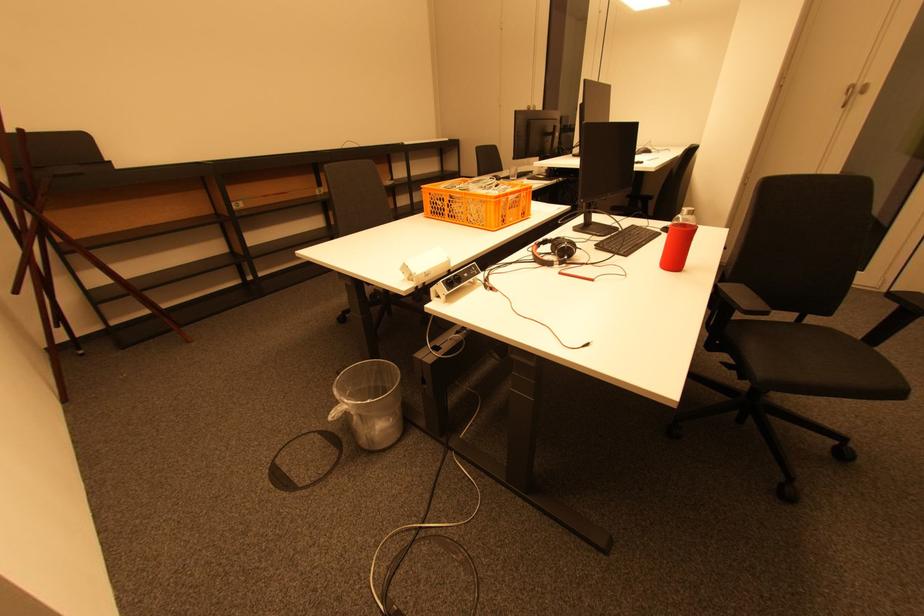
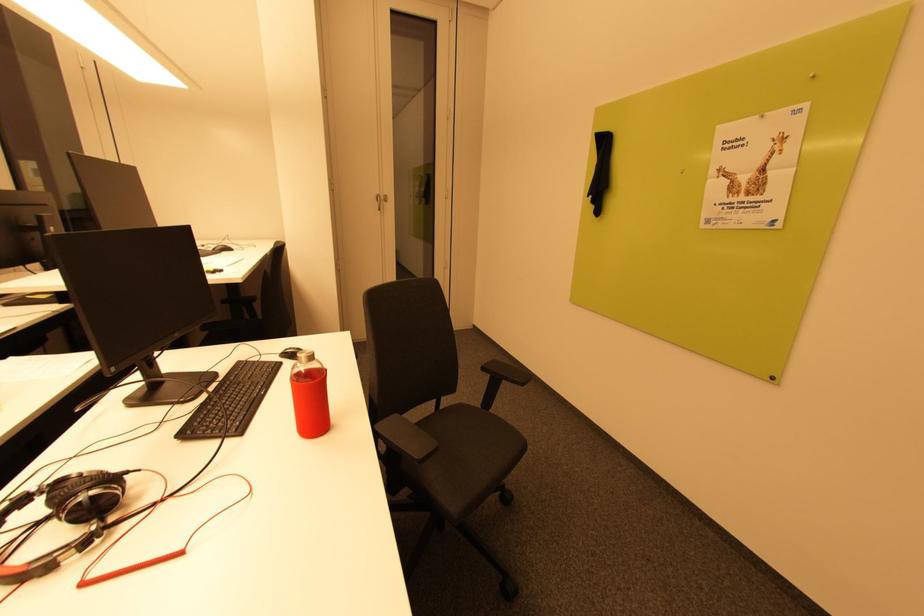
Question: The images are taken continuously from a first-person perspective. In which direction is your viewpoint rotating?

Choices:
 (A) Left
 (B) Right
 (C) Up
 (D) Down

Answer: (B)